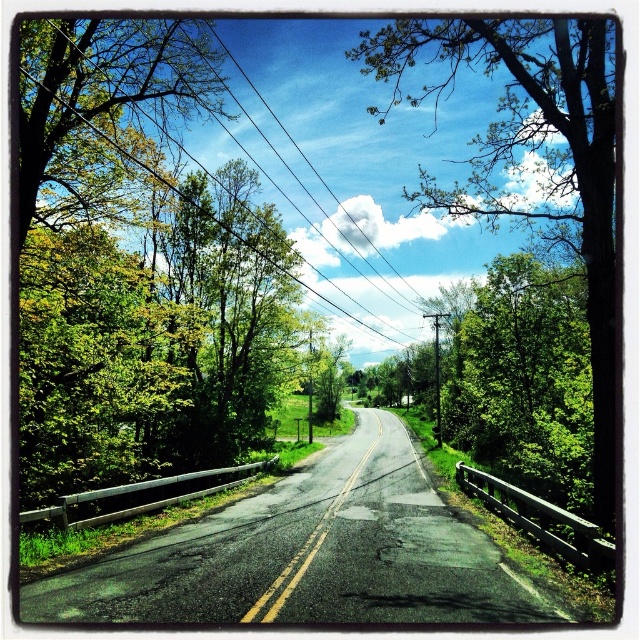
Question: Does green leafy tree at center have a greater width compared to black wire at upper center?

Choices:
 (A) no
 (B) yes

Answer: (B)

Question: Which point is farther to the camera?

Choices:
 (A) (220, 38)
 (B) (108, 332)
 (C) (515, 180)

Answer: (C)

Question: Is green leafy tree at left to the left of black wire at upper center from the viewer's perspective?

Choices:
 (A) no
 (B) yes

Answer: (B)

Question: Which of the following is the closest to the observer?

Choices:
 (A) (524, 19)
 (B) (356, 221)

Answer: (A)

Question: Can you confirm if green leafy tree at left is bigger than green leafy tree at center?

Choices:
 (A) no
 (B) yes

Answer: (A)

Question: Which point appears farthest from the camera in this image?

Choices:
 (A) (401, 276)
 (B) (381, 29)

Answer: (A)